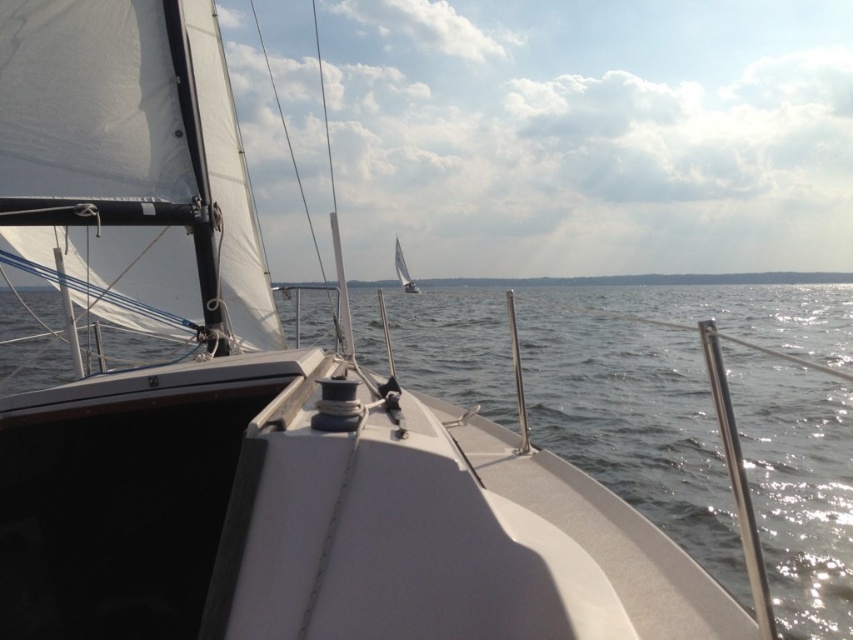
You are standing on the deck of the sailboat and want to move from the bow towards the second boat in the distance. There are two points marked on the deck, point A at coordinates point (523,145) and point B at coordinates point (398,246). Which point should you avoid stepping on if you want to stay closer to the bow?

You should avoid stepping on point B at coordinates point (398,246) because point A at coordinates point (523,145) is closer to the bow and staying near it keeps you nearer to the front of the boat.

You are standing on the deck of the sailboat and looking towards the horizon. You see a white cloud at upper center and a white sailboat at center. Which object is higher from the deck of the sailboat?

The white cloud at upper center is taller than the white sailboat at center from the deck of the sailboat.

You are a sailor on the deck of the white sailboat at center and you notice a white cloud at upper center. Which one appears wider from your current position?

The white cloud at upper center appears wider than the white sailboat at center because its width is larger according to the description.